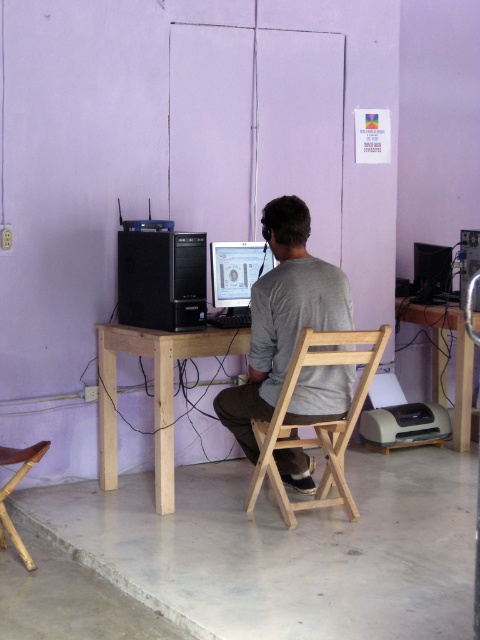
Based on the photo, you are standing in the workspace and want to sit down. There is a point marked at coordinates [315,419]. What object is located at that point?

The point at coordinates [315,419] marks the location of the light wood folding chair at center.

You are organizing a small meeting in the workspace and need to place a 1.2 meter wide tablecloth on the desk. Considering the light wood folding chair at center and the matte black monitor at right, which object might interfere with the tablecloth placement due to its size?

The light wood folding chair at center has a larger width than the matte black monitor at right, so it is more likely to interfere with the tablecloth placement due to its size.

You are standing at the entrance of the room and want to sit down at the light wood folding chair at center. The point representing the chair is at coordinate (315,419). If you move straight towards the chair, will you reach it without any obstacles?

The light wood folding chair at center is represented by point (315,419). Since there are no objects mentioned between you and the chair, moving straight should allow you to reach it without obstacles.